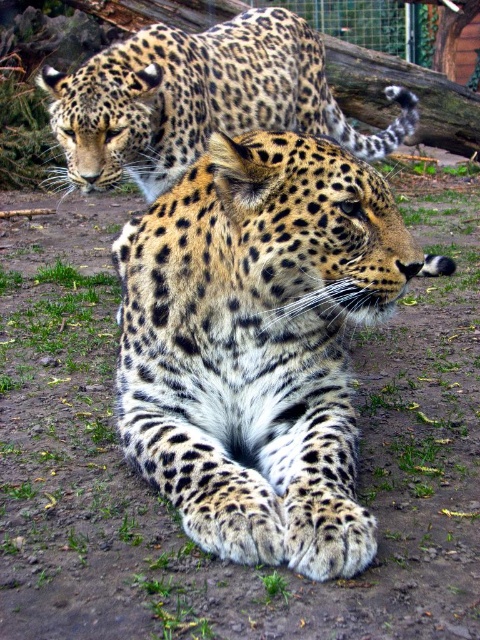
Question: Observing the image, what is the correct spatial positioning of spotted fur cheetah at center in reference to spotted fur leopard at upper center?

Choices:
 (A) right
 (B) left

Answer: (A)

Question: Does spotted fur cheetah at center have a lesser width compared to spotted fur leopard at upper center?

Choices:
 (A) yes
 (B) no

Answer: (A)

Question: Does spotted fur cheetah at center have a larger size compared to spotted fur leopard at upper center?

Choices:
 (A) yes
 (B) no

Answer: (B)